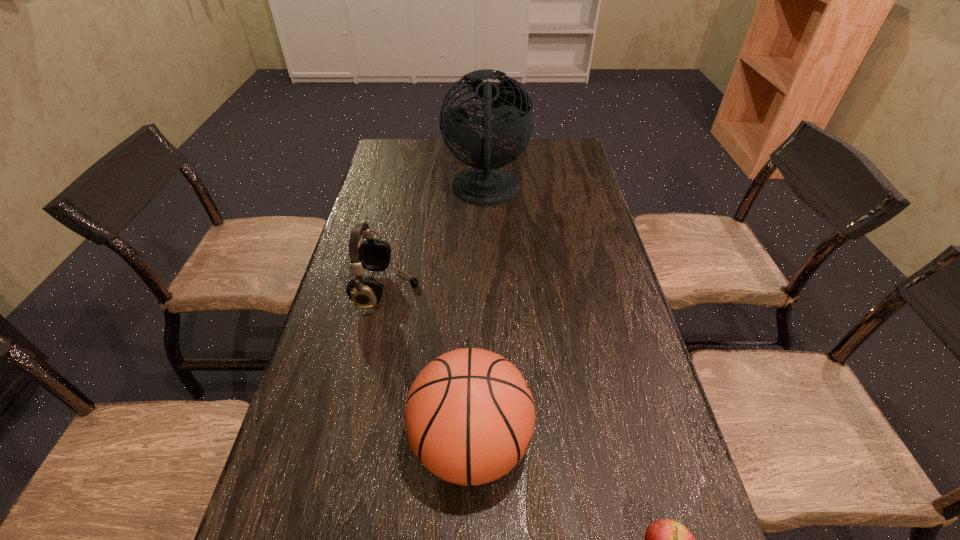
Where is `the closest object relative to the third farthest object`? Image resolution: width=960 pixels, height=540 pixels. the closest object relative to the third farthest object is located at coordinates (665, 539).